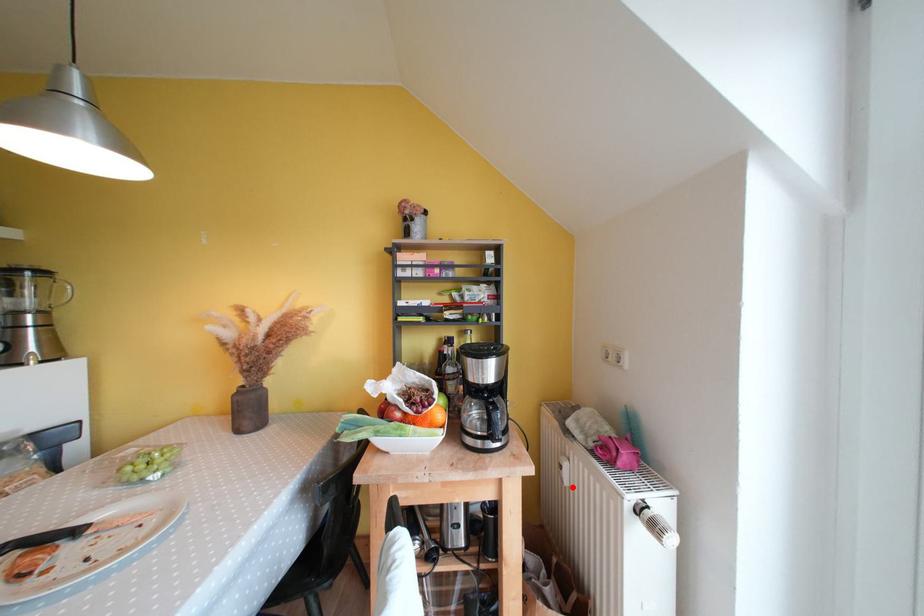
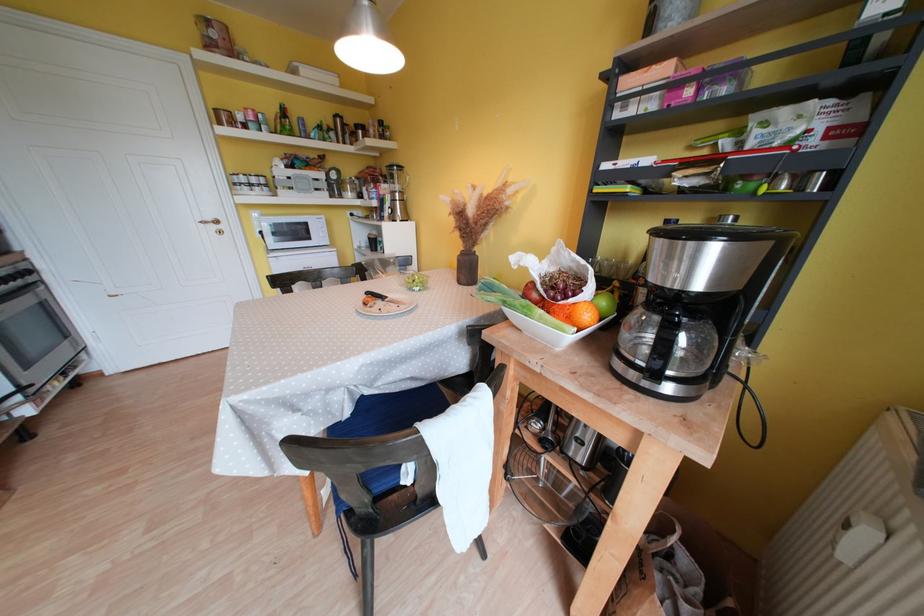
Where in the second image is the point corresponding to the highlighted location from the first image?

(850, 562)